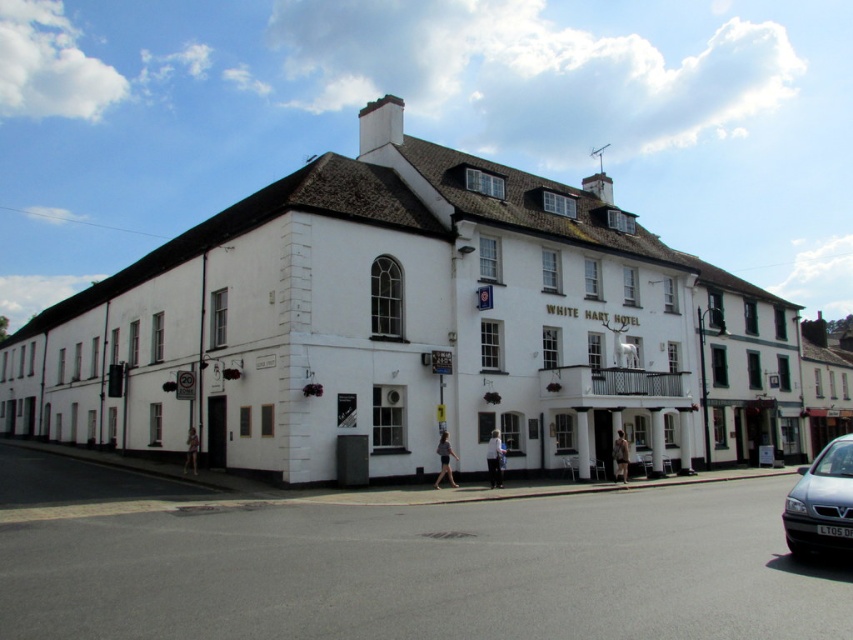
Question: Does white painted building at center appear on the left side of silver metallic van at lower right?

Choices:
 (A) no
 (B) yes

Answer: (B)

Question: Which object is farther from the camera taking this photo?

Choices:
 (A) white painted building at center
 (B) silver metallic van at lower right

Answer: (A)

Question: Is white painted building at center further to camera compared to silver metallic van at lower right?

Choices:
 (A) yes
 (B) no

Answer: (A)

Question: Which of the following is the closest to the observer?

Choices:
 (A) white painted building at center
 (B) silver metallic van at lower right

Answer: (B)

Question: Is white painted building at center positioned before silver metallic van at lower right?

Choices:
 (A) no
 (B) yes

Answer: (A)